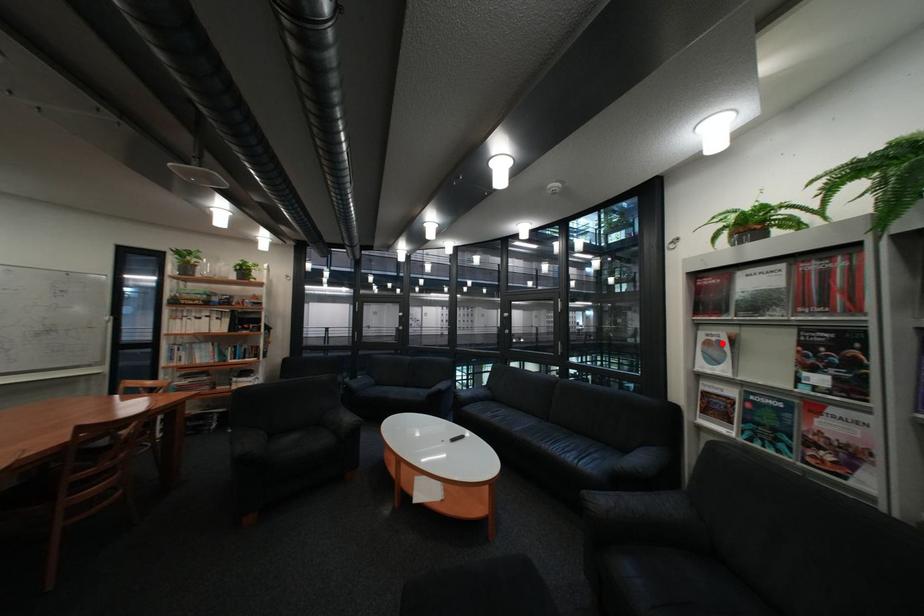
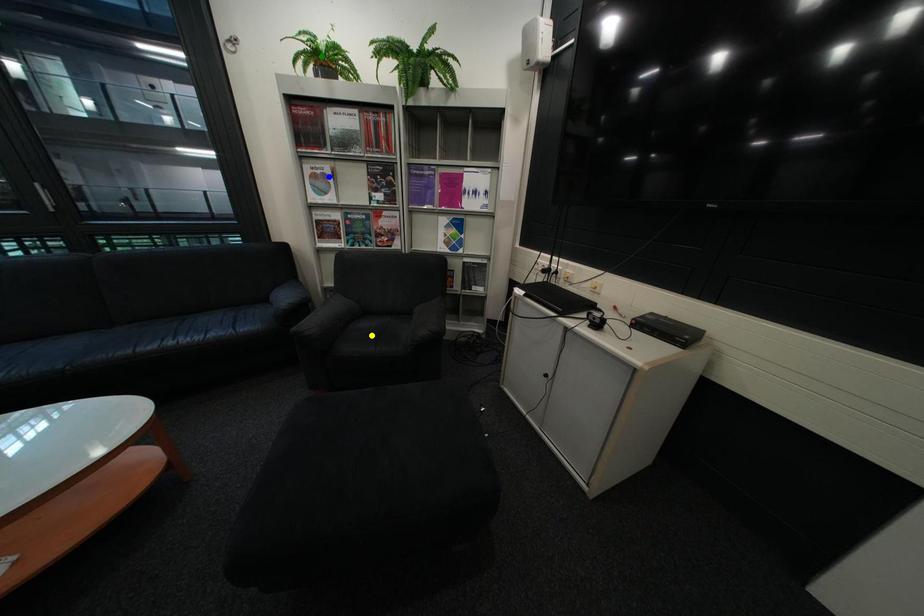
Question: I am providing you with two images of the same scene from different viewpoints. A red point is marked on the first image. You are given multiple points on the second image. Which point in image 2 is actually the same real-world point as the red point in image 1?

Choices:
 (A) blue point
 (B) yellow point
 (C) green point

Answer: (A)